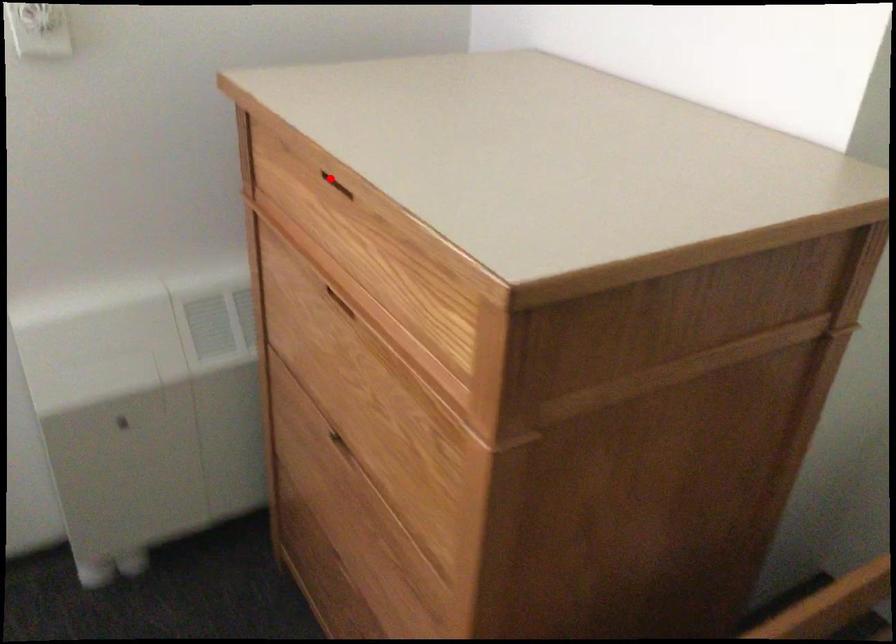
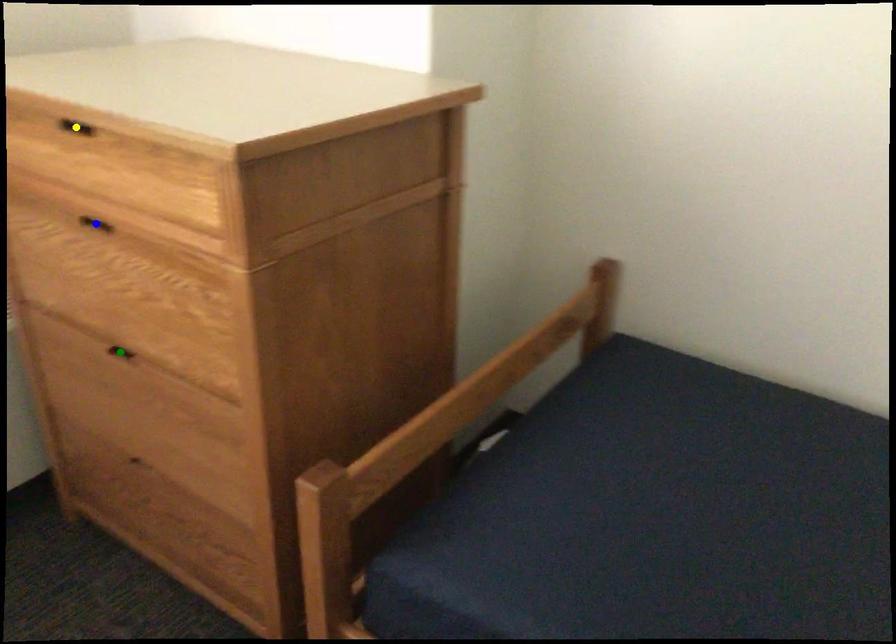
Question: I am providing you with two images of the same scene from different viewpoints. A red point is marked on the first image. You are given multiple points on the second image. Which mark in image 2 goes with the point in image 1?

Choices:
 (A) blue point
 (B) green point
 (C) yellow point

Answer: (C)